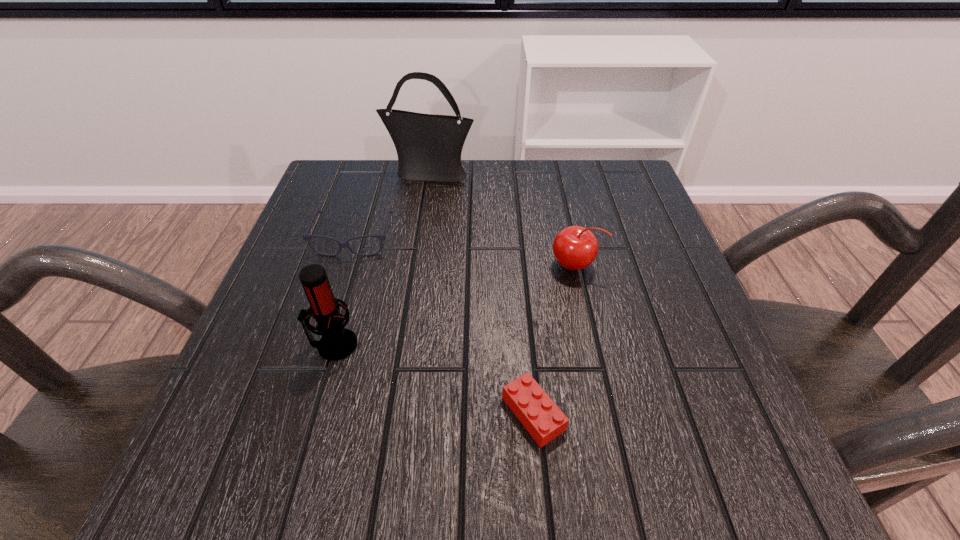
The width and height of the screenshot is (960, 540). I want to click on shoulder bag, so click(429, 147).

The image size is (960, 540). I want to click on the farthest object, so click(x=429, y=147).

Find the location of `the second tallest object`. the second tallest object is located at coordinates (337, 342).

Identify the location of microphone. The width and height of the screenshot is (960, 540). (337, 342).

At what (x,y) coordinates should I click in order to perform the action: click on cherry. Please return your answer as a coordinate pair (x, y). Looking at the image, I should click on (575, 248).

The height and width of the screenshot is (540, 960). I want to click on the rightmost object, so click(575, 248).

Identify the location of spectacles. (306, 236).

Locate an element on the screen. Image resolution: width=960 pixels, height=540 pixels. Lego is located at coordinates (542, 418).

Locate an element on the screen. Image resolution: width=960 pixels, height=540 pixels. the fourth object from left to right is located at coordinates (542, 418).

Locate an element on the screen. free space located on the front of the shoulder bag is located at coordinates (410, 302).